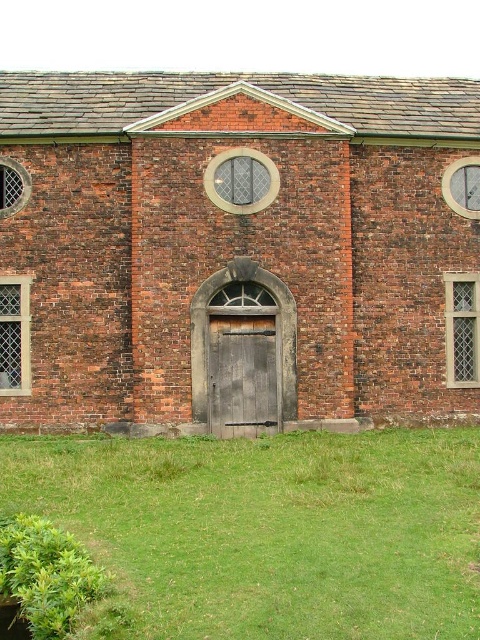
Which is more to the right, smooth wooden door at center or wooden door at center?

smooth wooden door at center is more to the right.

Is point (133, 115) farther from camera compared to point (218, 410)?

Yes, it is.

Identify the location of smooth wooden door at center. The height and width of the screenshot is (640, 480). (237, 250).

Is smooth wooden door at center further to the viewer compared to green grass at lower center?

Yes, smooth wooden door at center is behind green grass at lower center.

What do you see at coordinates (237, 250) in the screenshot?
I see `smooth wooden door at center` at bounding box center [237, 250].

At what (x,y) coordinates should I click in order to perform the action: click on smooth wooden door at center. Please return your answer as a coordinate pair (x, y). The width and height of the screenshot is (480, 640). Looking at the image, I should click on (237, 250).

The height and width of the screenshot is (640, 480). In order to click on smooth wooden door at center in this screenshot , I will do `click(237, 250)`.

Is point (196, 492) less distant than point (235, 349)?

Yes, point (196, 492) is closer to viewer.

At what (x,y) coordinates should I click in order to perform the action: click on green grass at lower center. Please return your answer as a coordinate pair (x, y). The height and width of the screenshot is (640, 480). Looking at the image, I should click on (271, 529).

Is point (418, 522) more distant than point (241, 392)?

No, (418, 522) is closer to viewer.

Identify the location of green grass at lower center. This screenshot has width=480, height=640. (271, 529).